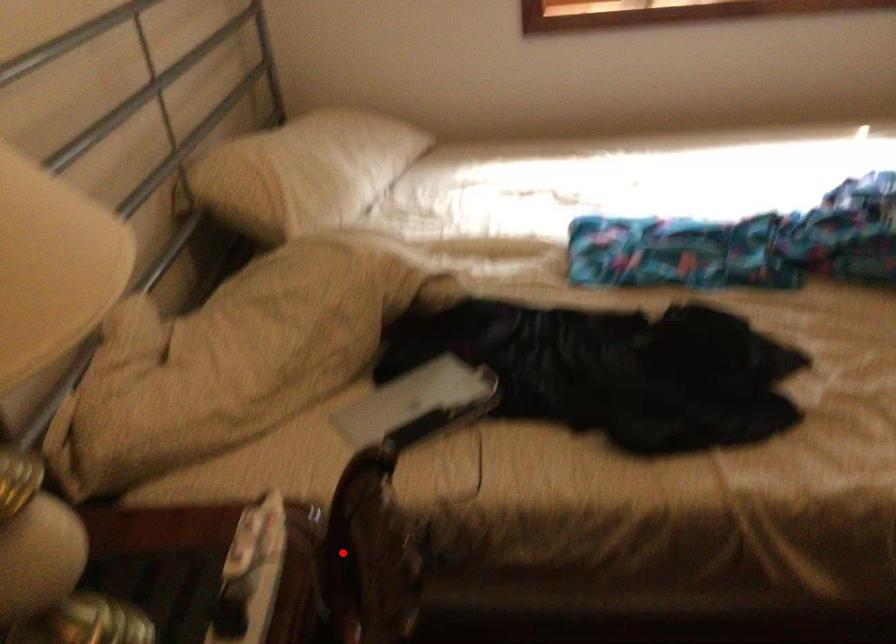
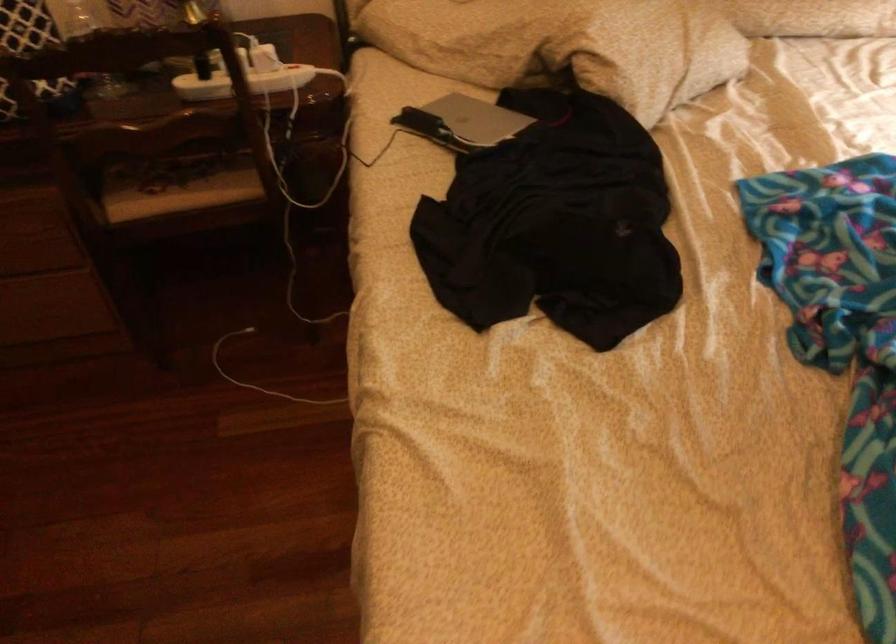
Question: I am providing you with two images of the same scene from different viewpoints. In image1, a red point is highlighted. Considering the same 3D point in image2, which of the following is correct?

Choices:
 (A) It is closer
 (B) It is farther

Answer: (B)